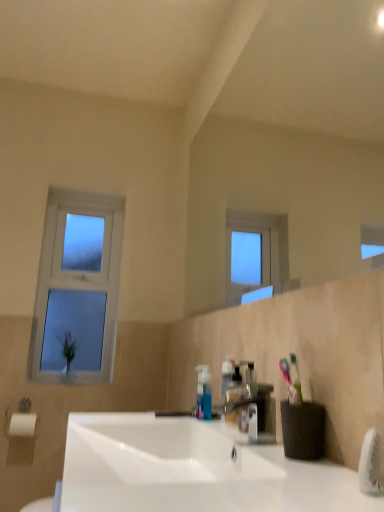
Question: Could matte plastic tap at center be considered to be inside clear glass window at left?

Choices:
 (A) no
 (B) yes

Answer: (A)

Question: Does clear glass window at left have a greater height compared to matte plastic tap at center?

Choices:
 (A) no
 (B) yes

Answer: (B)

Question: Can you confirm if clear glass window at left is shorter than matte plastic tap at center?

Choices:
 (A) no
 (B) yes

Answer: (A)

Question: Is clear glass window at left directly adjacent to matte plastic tap at center?

Choices:
 (A) no
 (B) yes

Answer: (A)

Question: Is clear glass window at left looking in the opposite direction of matte plastic tap at center?

Choices:
 (A) yes
 (B) no

Answer: (B)

Question: From a real-world perspective, is matte plastic tap at center physically located above or below white glossy sink at center?

Choices:
 (A) below
 (B) above

Answer: (B)

Question: Visually, is matte plastic tap at center positioned to the left or to the right of white glossy sink at center?

Choices:
 (A) right
 (B) left

Answer: (A)

Question: Is point (238, 394) closer or farther from the camera than point (122, 479)?

Choices:
 (A) farther
 (B) closer

Answer: (A)

Question: Looking at the image, does matte plastic tap at center seem bigger or smaller compared to white glossy sink at center?

Choices:
 (A) big
 (B) small

Answer: (B)

Question: Based on their sizes in the image, would you say white glossy sink at center is bigger or smaller than clear glass window at left?

Choices:
 (A) big
 (B) small

Answer: (A)

Question: Considering the positions of point (147, 432) and point (109, 313), is point (147, 432) closer or farther from the camera than point (109, 313)?

Choices:
 (A) closer
 (B) farther

Answer: (A)

Question: Is white glossy sink at center to the left or to the right of clear glass window at left in the image?

Choices:
 (A) right
 (B) left

Answer: (A)

Question: Choose the correct answer: Is white glossy sink at center inside clear glass window at left or outside it?

Choices:
 (A) outside
 (B) inside

Answer: (A)

Question: Based on their positions, is matte plastic tap at center located to the left or right of clear glass window at left?

Choices:
 (A) left
 (B) right

Answer: (B)

Question: Relative to clear glass window at left, is matte plastic tap at center in front or behind?

Choices:
 (A) front
 (B) behind

Answer: (A)